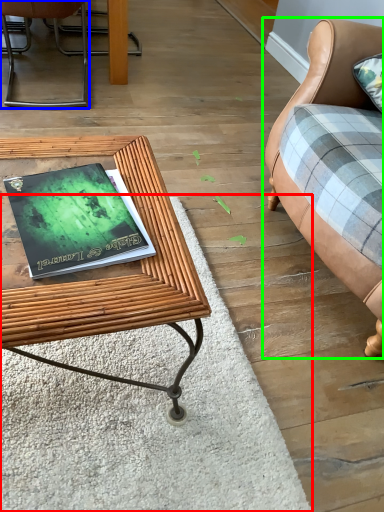
Question: Based on their relative distances, which object is farther from mat (highlighted by a red box)? Choose from chair (highlighted by a blue box) and studio couch (highlighted by a green box).

Choices:
 (A) chair
 (B) studio couch

Answer: (A)